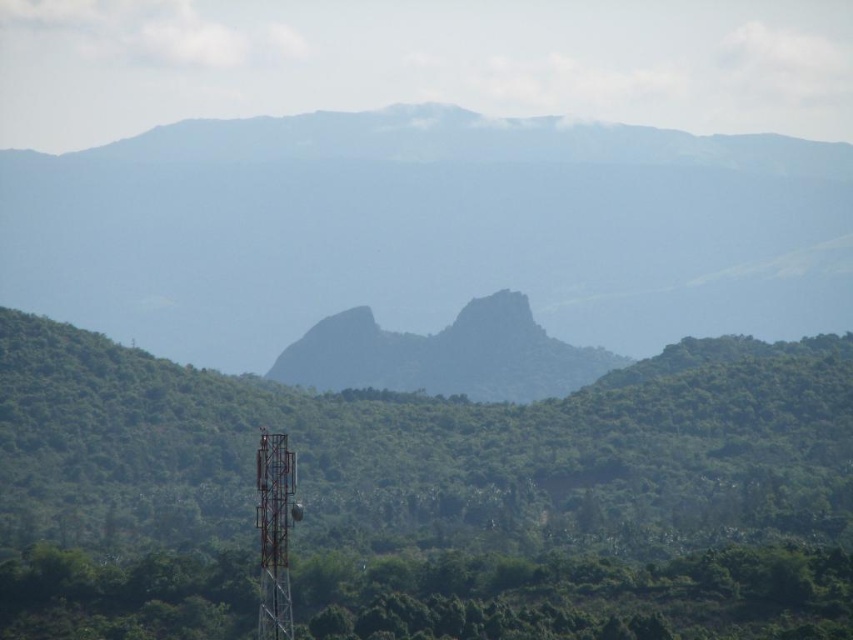
Can you confirm if green leafy vegetation at center is thinner than green rough rock at center?

No, green leafy vegetation at center is not thinner than green rough rock at center.

Consider the image. Who is more distant from viewer, (71, 605) or (483, 355)?

The point (483, 355) is more distant.

The width and height of the screenshot is (853, 640). I want to click on green leafy vegetation at center, so click(x=581, y=596).

Between point (489, 124) and point (276, 616), which one is positioned behind?

Point (489, 124)

Is green textured mountain at center thinner than metallic tower at center?

Incorrect, green textured mountain at center's width is not less than metallic tower at center's.

Is point (35, 182) farther from viewer compared to point (273, 576)?

That is True.

Find the location of a particular element. The height and width of the screenshot is (640, 853). green textured mountain at center is located at coordinates [x=427, y=230].

Is green leafy vegetation at center below metallic tower at center?

Correct, green leafy vegetation at center is located below metallic tower at center.

Who is lower down, green leafy vegetation at center or metallic tower at center?

green leafy vegetation at center is lower down.

Find the location of a particular element. green leafy vegetation at center is located at coordinates (581, 596).